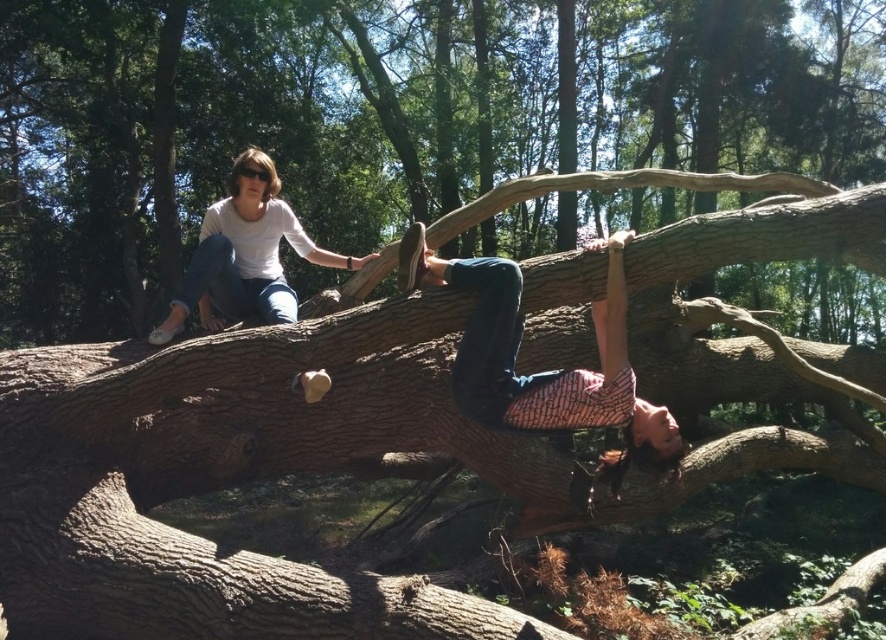
Which is in front, point (475, 390) or point (201, 296)?

Point (475, 390) is more forward.

Between patterned fabric shirt at upper center and white matte shirt at upper left, which one appears on the right side from the viewer's perspective?

From the viewer's perspective, patterned fabric shirt at upper center appears more on the right side.

What do you see at coordinates (550, 371) in the screenshot? Image resolution: width=886 pixels, height=640 pixels. I see `patterned fabric shirt at upper center` at bounding box center [550, 371].

The height and width of the screenshot is (640, 886). I want to click on patterned fabric shirt at upper center, so (x=550, y=371).